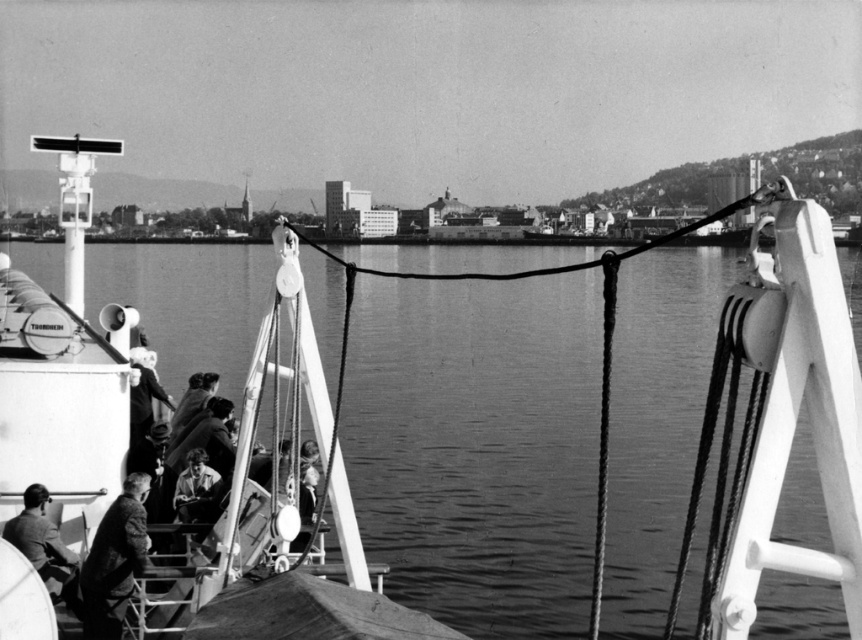
Which of these two, dark suit at lower left or smooth leather jacket at lower center, stands shorter?

With less height is dark suit at lower left.

Is point (117, 588) positioned after point (177, 496)?

No, it is in front of (177, 496).

Consider the image. Who is more distant from viewer, [110,611] or [186,472]?

Point [186,472]

I want to click on dark suit at lower left, so click(114, 561).

Image resolution: width=862 pixels, height=640 pixels. Describe the element at coordinates (478, 445) in the screenshot. I see `smooth water at center` at that location.

What do you see at coordinates (478, 445) in the screenshot? I see `smooth water at center` at bounding box center [478, 445].

Locate an element on the screen. smooth water at center is located at coordinates (478, 445).

This screenshot has width=862, height=640. What are the coordinates of `dark suit at lower left` in the screenshot? It's located at (114, 561).

Who is more forward, (117, 636) or (47, 547)?

Positioned in front is point (117, 636).

Does point (105, 529) come farther from viewer compared to point (66, 552)?

No, (105, 529) is in front of (66, 552).

Where is `dark suit at lower left`? dark suit at lower left is located at coordinates (114, 561).